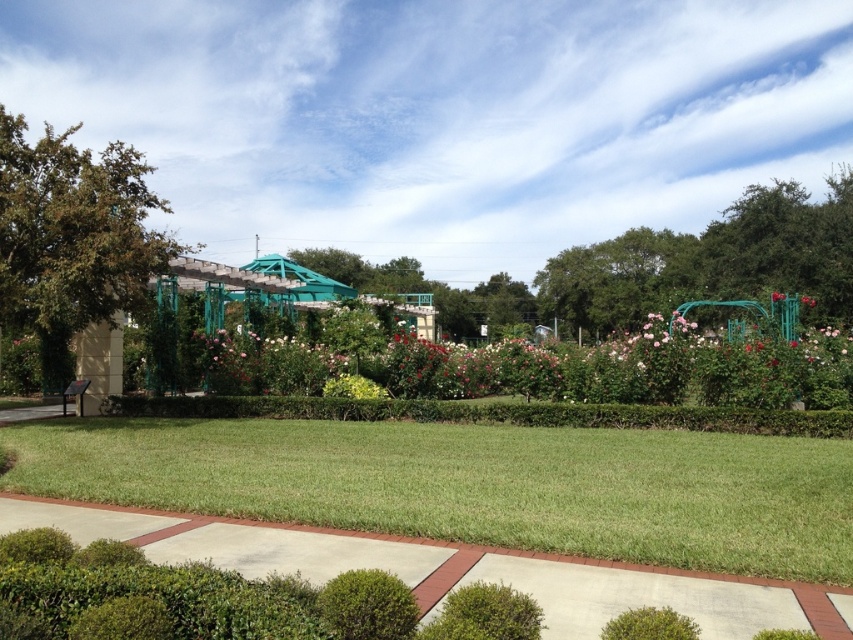
Question: Does green leafy tree at left appear under green leafy tree at center?

Choices:
 (A) no
 (B) yes

Answer: (A)

Question: Is green grass at center closer to the viewer compared to green leafy tree at left?

Choices:
 (A) yes
 (B) no

Answer: (A)

Question: Is green metal trellis at center below green leafy tree at left?

Choices:
 (A) yes
 (B) no

Answer: (A)

Question: Which point is closer to the camera?

Choices:
 (A) (677, 294)
 (B) (814, 301)

Answer: (B)

Question: Which of these objects is positioned closest to the green leafy bush at lower center?

Choices:
 (A) pink matte rose at center
 (B) green metal trellis at center

Answer: (A)

Question: Among these points, which one is nearest to the camera?

Choices:
 (A) (492, 614)
 (B) (814, 305)

Answer: (A)